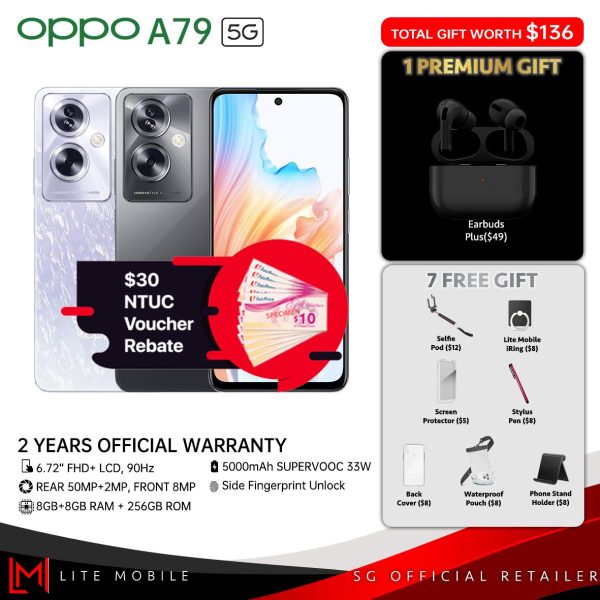
I want to click on image of a red stylus pen, so click(519, 385).